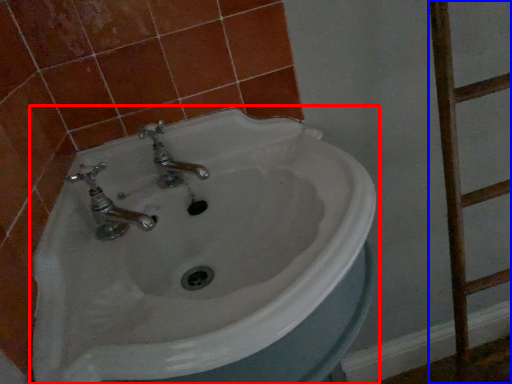
Question: Which object appears closest to the camera in this image, sink (highlighted by a red box) or ladder (highlighted by a blue box)?

Choices:
 (A) sink
 (B) ladder

Answer: (A)